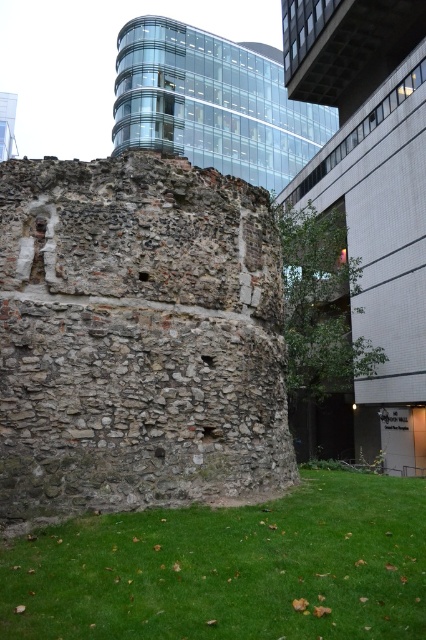
You are standing in a park and see the green grass at lower center and the clear glass building at upper center. Which object is closer to you?

The green grass at lower center is closer to you because it is located below the clear glass building at upper center, which is further away.

You are an architect analyzing the spatial relationship between the rustic stone ruins at center and the clear glass building at upper center in the image. Which structure is positioned to the right of the other?

The rustic stone ruins at center are positioned to the right of the clear glass building at upper center.